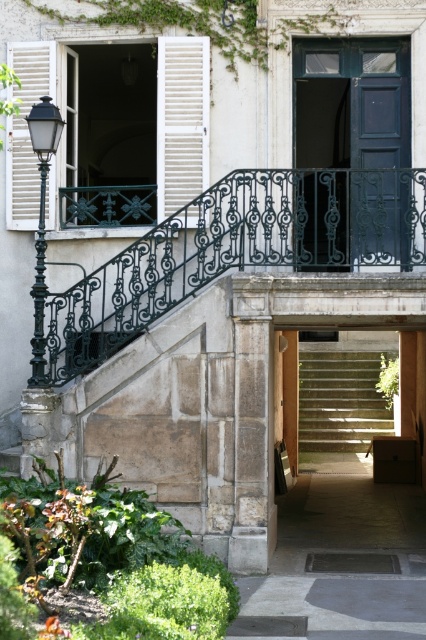
Can you confirm if black wrought iron balustrade at center is thinner than white wooden shutter at left?

In fact, black wrought iron balustrade at center might be wider than white wooden shutter at left.

Can you confirm if black wrought iron balustrade at center is wider than white wooden shutter at left?

Yes.

Does point (186, 292) come closer to viewer compared to point (45, 81)?

That is True.

The width and height of the screenshot is (426, 640). In order to click on black wrought iron balustrade at center in this screenshot , I will do pos(230,253).

Can you confirm if white wooden shutters at upper left is smaller than black wrought iron streetlamp at left?

Yes, white wooden shutters at upper left is smaller than black wrought iron streetlamp at left.

Does white wooden shutters at upper left appear over black wrought iron streetlamp at left?

Yes.

Is point (157, 72) positioned after point (43, 360)?

Yes, point (157, 72) is behind point (43, 360).

The height and width of the screenshot is (640, 426). I want to click on white wooden shutters at upper left, so click(181, 122).

Does dark blue wood door at center have a lesser height compared to white wooden shutters at upper left?

No.

The height and width of the screenshot is (640, 426). What do you see at coordinates (354, 150) in the screenshot? I see `dark blue wood door at center` at bounding box center [354, 150].

Locate an element on the screen. The image size is (426, 640). dark blue wood door at center is located at coordinates (354, 150).